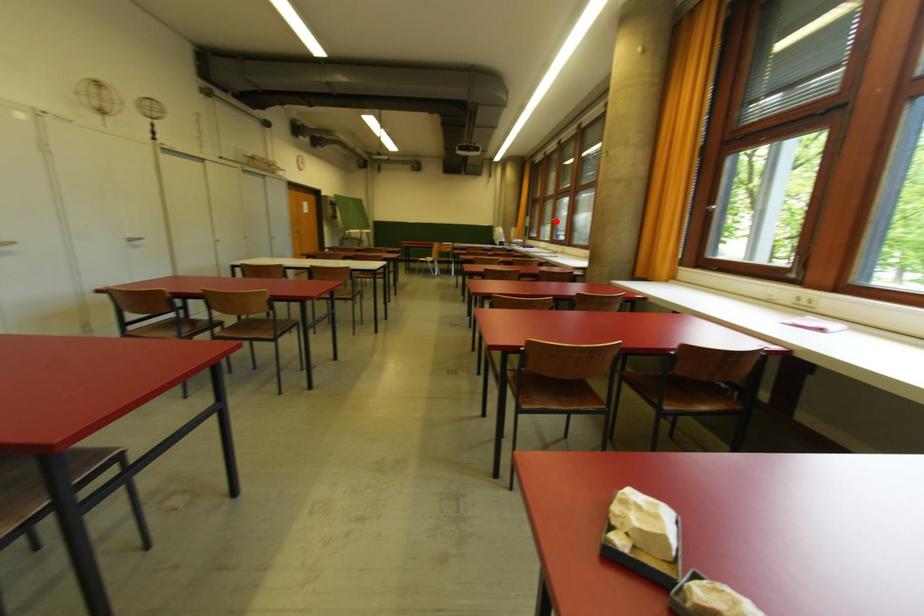
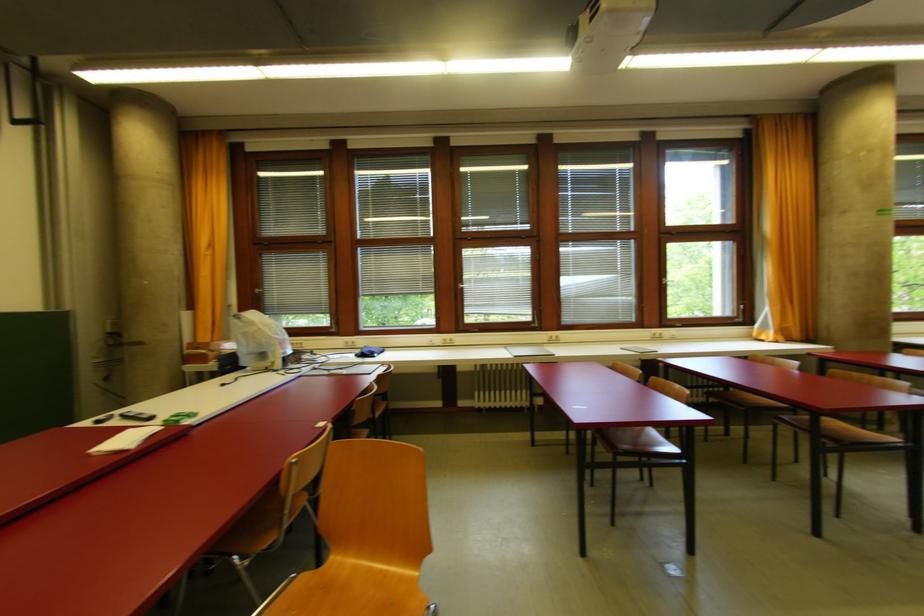
Question: I am providing you with two images of the same scene from different viewpoints. A red point is shown in image1. For the corresponding object point in image2, is it positioned nearer or farther from the camera?

Choices:
 (A) Nearer
 (B) Farther

Answer: (B)